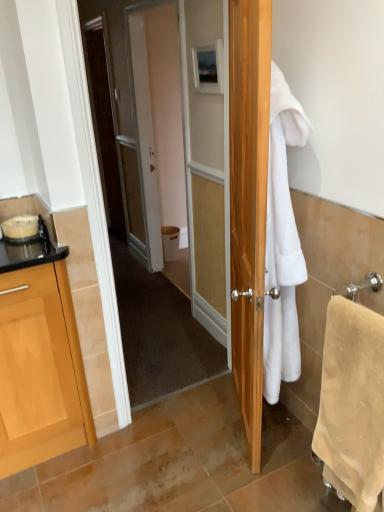
Question: Can you confirm if matte wooden picture frame at upper center is thinner than white fluffy towel at right, positioned as the 2th towel/napkin in right-to-left order?

Choices:
 (A) yes
 (B) no

Answer: (A)

Question: Does matte wooden picture frame at upper center have a larger size compared to white fluffy towel at right, positioned as the 2th towel/napkin in right-to-left order?

Choices:
 (A) no
 (B) yes

Answer: (A)

Question: Is white fluffy towel at right, which is the 1th towel/napkin from left to right, at the back of matte wooden picture frame at upper center?

Choices:
 (A) no
 (B) yes

Answer: (A)

Question: From a real-world perspective, is matte wooden picture frame at upper center over white fluffy towel at right, positioned as the 2th towel/napkin in right-to-left order?

Choices:
 (A) no
 (B) yes

Answer: (B)

Question: Does matte wooden picture frame at upper center appear on the left side of white fluffy towel at right, which is the 1th towel/napkin from left to right?

Choices:
 (A) no
 (B) yes

Answer: (B)

Question: From a real-world perspective, is white plastic trash bin at center positioned above or below matte wooden picture frame at upper center?

Choices:
 (A) above
 (B) below

Answer: (B)

Question: Is white plastic trash bin at center to the left or to the right of matte wooden picture frame at upper center in the image?

Choices:
 (A) left
 (B) right

Answer: (A)

Question: Considering the positions of white plastic trash bin at center and matte wooden picture frame at upper center in the image, is white plastic trash bin at center wider or thinner than matte wooden picture frame at upper center?

Choices:
 (A) thin
 (B) wide

Answer: (B)

Question: From the image's perspective, is white plastic trash bin at center above or below matte wooden picture frame at upper center?

Choices:
 (A) below
 (B) above

Answer: (A)

Question: From the image's perspective, is matte wooden picture frame at upper center positioned above or below white fluffy towel at right, which is the 1th towel/napkin from left to right?

Choices:
 (A) above
 (B) below

Answer: (A)

Question: Would you say matte wooden picture frame at upper center is to the left or to the right of white fluffy towel at right, which is the 1th towel/napkin from left to right, in the picture?

Choices:
 (A) right
 (B) left

Answer: (B)

Question: From a real-world perspective, is matte wooden picture frame at upper center physically located above or below white fluffy towel at right, which is the 1th towel/napkin from left to right?

Choices:
 (A) above
 (B) below

Answer: (A)

Question: In the image, is matte wooden picture frame at upper center positioned in front of or behind white fluffy towel at right, which is the 1th towel/napkin from left to right?

Choices:
 (A) behind
 (B) front

Answer: (A)

Question: Is white fluffy towel at right, which is the 1th towel/napkin from left to right, wider or thinner than beige soft towel at right, acting as the 1th towel/napkin starting from the right?

Choices:
 (A) thin
 (B) wide

Answer: (B)

Question: Does point (296, 124) appear closer or farther from the camera than point (344, 397)?

Choices:
 (A) farther
 (B) closer

Answer: (A)